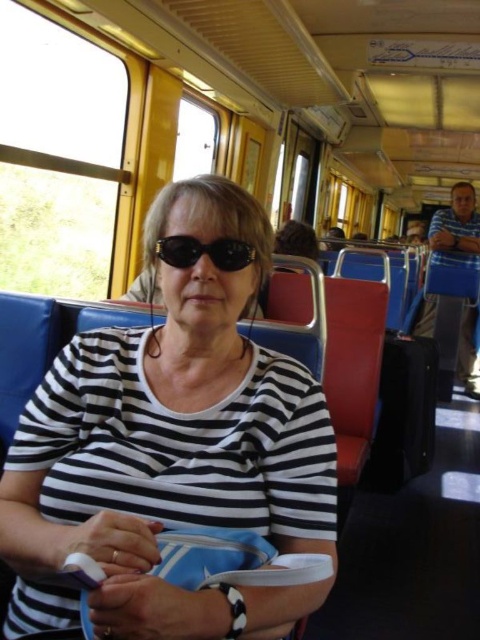
Question: Which object is farther from the camera taking this photo?

Choices:
 (A) black striped shirt at center
 (B) black rubber goggles at center

Answer: (B)

Question: Is blue fabric coach at right thinner than black rubber goggles at center?

Choices:
 (A) yes
 (B) no

Answer: (B)

Question: Which of the following is the farthest from the observer?

Choices:
 (A) (479, 394)
 (B) (94, 346)
 (C) (187, 264)

Answer: (A)

Question: Can you confirm if black striped shirt at center is positioned to the left of blue fabric coach at right?

Choices:
 (A) no
 (B) yes

Answer: (B)

Question: Is black striped shirt at center positioned before black rubber goggles at center?

Choices:
 (A) no
 (B) yes

Answer: (B)

Question: Which object is closer to the camera taking this photo?

Choices:
 (A) blue fabric coach at right
 (B) black striped shirt at center

Answer: (B)